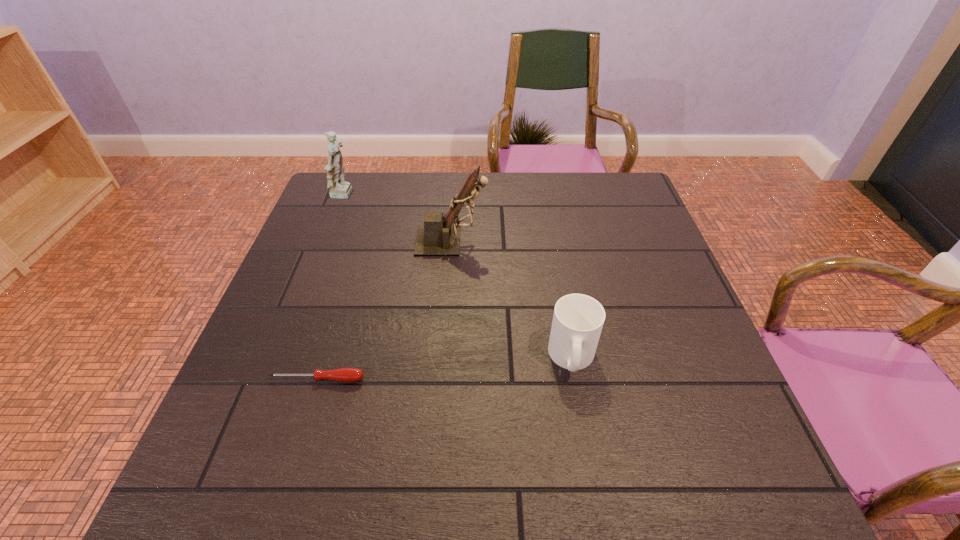
This screenshot has height=540, width=960. I want to click on vacant area at the far right corner, so click(631, 178).

At what (x,y) coordinates should I click in order to perform the action: click on vacant area that lies between the shortest object and the farther figurine. Please return your answer as a coordinate pair (x, y). Looking at the image, I should click on (331, 287).

Where is `free space that is in between the left figurine and the shortest object`? This screenshot has width=960, height=540. free space that is in between the left figurine and the shortest object is located at coordinates [331, 287].

I want to click on free space that is in between the mug and the screwdriver, so click(x=444, y=368).

Image resolution: width=960 pixels, height=540 pixels. Identify the location of vacant area that lies between the rightmost object and the left figurine. (458, 276).

Where is `empty space that is in between the nearer figurine and the screwdriver`? empty space that is in between the nearer figurine and the screwdriver is located at coordinates (385, 310).

You are a GUI agent. You are given a task and a screenshot of the screen. Output one action in this format:
    pyautogui.click(x=<x>, y=<y>)
    Task: Click on the empty location between the third tallest object and the screwdriver
    This screenshot has width=960, height=540.
    Given the screenshot: What is the action you would take?
    pyautogui.click(x=444, y=368)

The image size is (960, 540). I want to click on free space between the right figurine and the mug, so click(512, 299).

Where is `free space between the shortest object and the right figurine`? The width and height of the screenshot is (960, 540). free space between the shortest object and the right figurine is located at coordinates (385, 310).

At what (x,y) coordinates should I click in order to perform the action: click on free space between the screwdriver and the rightmost object. Please return your answer as a coordinate pair (x, y). Looking at the image, I should click on (444, 368).